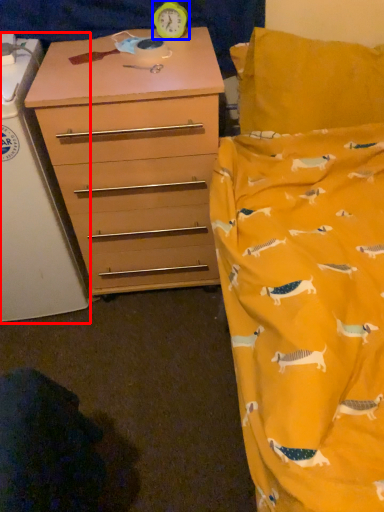
Question: Which of the following is the closest to the observer, changing table (highlighted by a red box) or clock (highlighted by a blue box)?

Choices:
 (A) changing table
 (B) clock

Answer: (A)